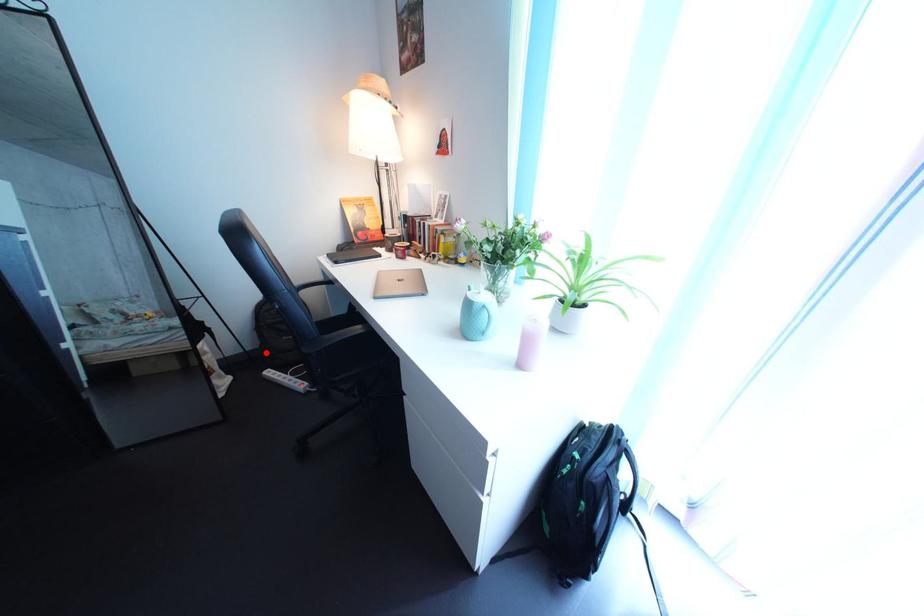
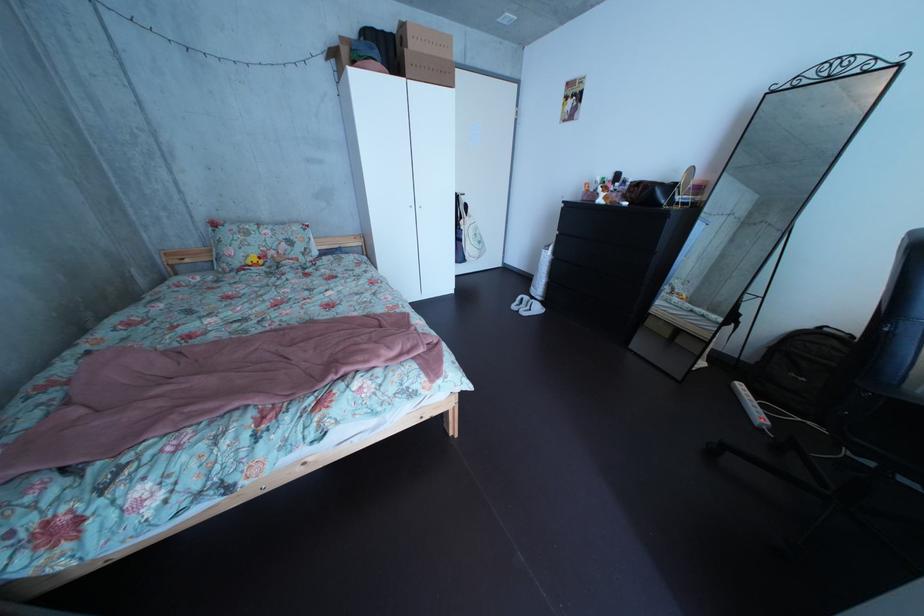
Question: A red point is marked in image1. In image2, is the corresponding 3D point closer to the camera or farther? Reply with the corresponding letter.

Choices:
 (A) The corresponding 3D point is closer.
 (B) The corresponding 3D point is farther.

Answer: (B)